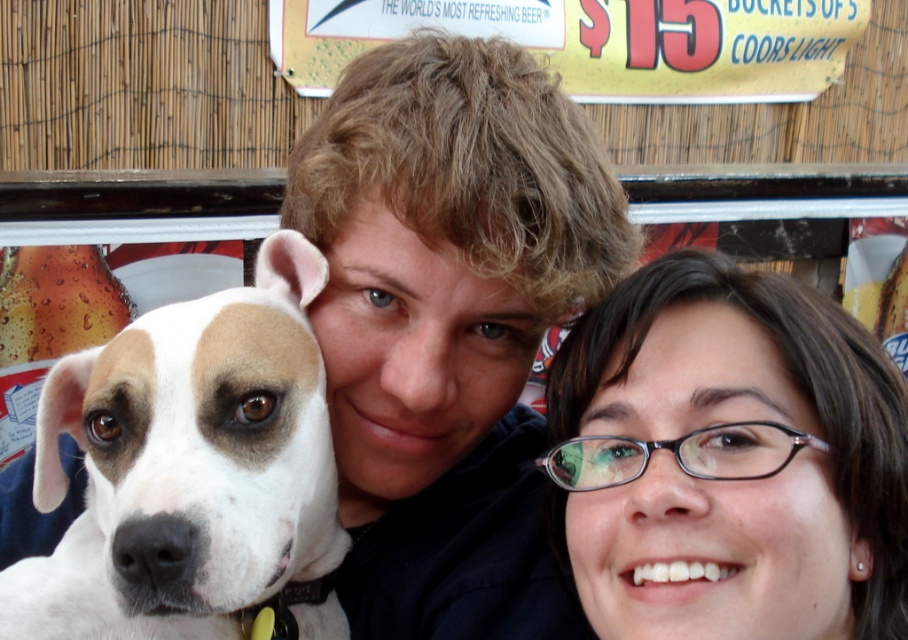
Question: Is the position of matte black shirt at center more distant than that of matte black glasses at upper right?

Choices:
 (A) yes
 (B) no

Answer: (A)

Question: Which of the following is the closest to the observer?

Choices:
 (A) white fur at left
 (B) matte black glasses at upper right
 (C) matte black shirt at center

Answer: (B)

Question: Which point is closer to the camera?

Choices:
 (A) (445, 388)
 (B) (821, 486)

Answer: (B)

Question: Which object appears farthest from the camera in this image?

Choices:
 (A) matte black shirt at center
 (B) matte black glasses at upper right
 (C) white fur at left

Answer: (A)

Question: Is matte black shirt at center further to the viewer compared to matte black glasses at upper right?

Choices:
 (A) no
 (B) yes

Answer: (B)

Question: Is matte black shirt at center below matte black glasses at upper right?

Choices:
 (A) yes
 (B) no

Answer: (B)